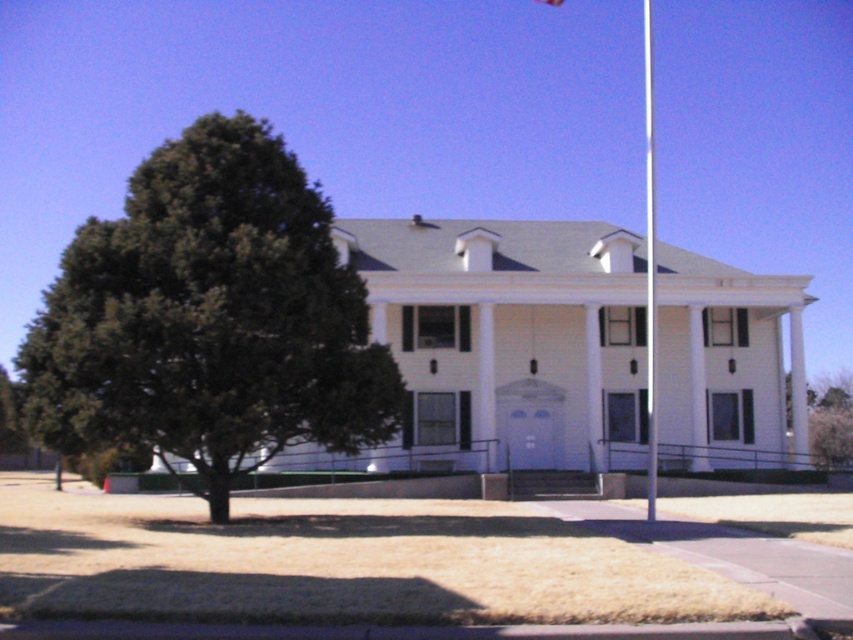
Question: Estimate the real-world distances between objects in this image. Which object is farther from the green leafy tree at center?

Choices:
 (A) white glossy flag pole at center
 (B) green leafy tree at left
 (C) white fabric flag at upper center

Answer: (C)

Question: Can you confirm if white glossy flag pole at center is positioned above white fabric flag at upper center?

Choices:
 (A) no
 (B) yes

Answer: (A)

Question: Which point is farther to the camera?

Choices:
 (A) (563, 1)
 (B) (53, 364)

Answer: (A)

Question: Which object is the farthest from the green leafy tree at center?

Choices:
 (A) green leafy tree at left
 (B) white fabric flag at upper center
 (C) white glossy flag pole at center

Answer: (B)

Question: Can you confirm if green leafy tree at left is positioned to the left of green leafy tree at center?

Choices:
 (A) no
 (B) yes

Answer: (B)

Question: Does green leafy tree at left have a larger size compared to green leafy tree at center?

Choices:
 (A) yes
 (B) no

Answer: (B)